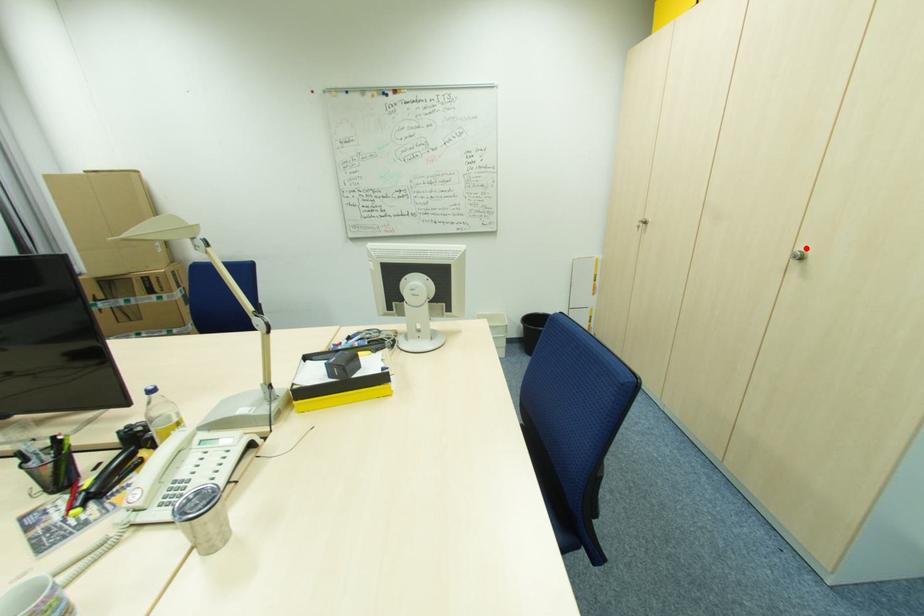
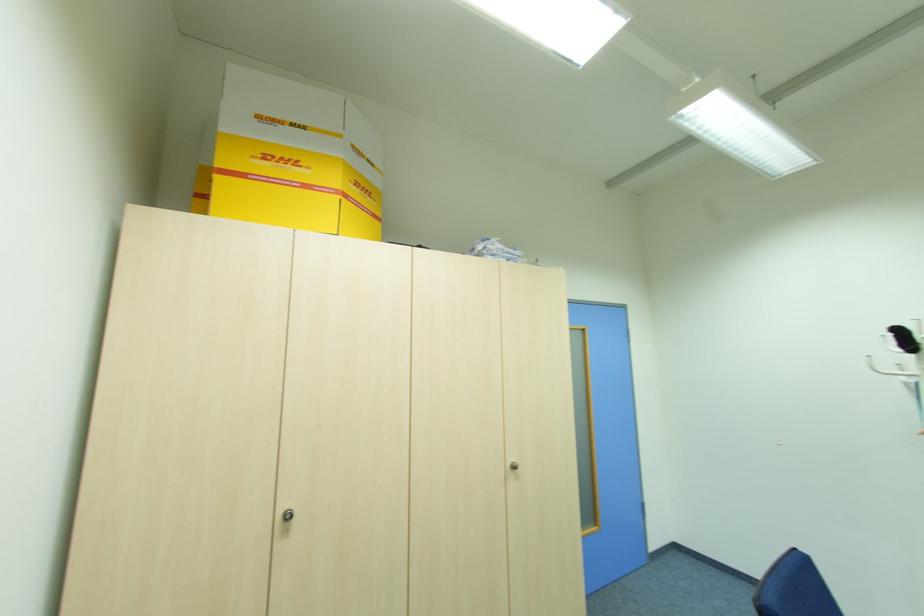
In the second image, find the point that corresponds to the highlighted location in the first image.

(513, 460)